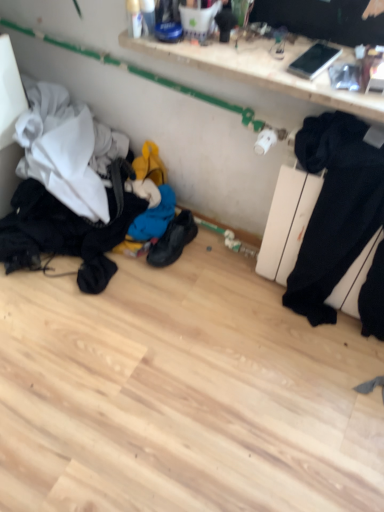
You are a GUI agent. You are given a task and a screenshot of the screen. Output one action in this format:
    pyautogui.click(x=<x>, y=<y>)
    Task: Click on the free space in front of black matte sweat pants at right
    The width and height of the screenshot is (384, 512).
    Given the screenshot: What is the action you would take?
    click(317, 370)